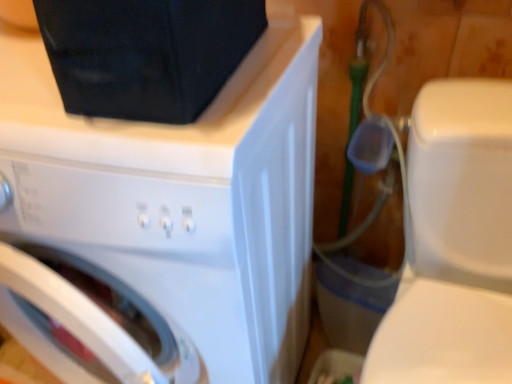
Measure the distance between white glossy toilet at right and camera.

white glossy toilet at right is 61.62 centimeters from camera.

Describe the element at coordinates (453, 242) in the screenshot. The image size is (512, 384). I see `white glossy toilet at right` at that location.

At what (x,y) coordinates should I click in order to perform the action: click on white glossy toilet at right. Please return your answer as a coordinate pair (x, y). The height and width of the screenshot is (384, 512). Looking at the image, I should click on (453, 242).

Describe the element at coordinates (163, 222) in the screenshot. This screenshot has height=384, width=512. I see `white glossy washing machine at upper left` at that location.

Identify the location of white glossy washing machine at upper left. (163, 222).

From the picture: What is the approximate height of white glossy washing machine at upper left?

The height of white glossy washing machine at upper left is 33.50 inches.

Locate an element on the screen. The image size is (512, 384). white glossy toilet at right is located at coordinates (453, 242).

Which is more to the left, white glossy toilet at right or white glossy washing machine at upper left?

white glossy washing machine at upper left is more to the left.

Between white glossy toilet at right and white glossy washing machine at upper left, which one is positioned behind?

white glossy washing machine at upper left is more distant.

Does point (460, 300) come in front of point (290, 146)?

No, it is behind (290, 146).

From the image's perspective, relative to white glossy washing machine at upper left, is white glossy toilet at right above or below?

white glossy toilet at right is below white glossy washing machine at upper left.

From a real-world perspective, between white glossy toilet at right and white glossy washing machine at upper left, who is vertically higher?

white glossy washing machine at upper left.

Does white glossy toilet at right have a lesser width compared to white glossy washing machine at upper left?

No.

From their relative heights in the image, would you say white glossy toilet at right is taller or shorter than white glossy washing machine at upper left?

Considering their sizes, white glossy toilet at right has less height than white glossy washing machine at upper left.

Between white glossy toilet at right and white glossy washing machine at upper left, which one has smaller size?

Smaller between the two is white glossy toilet at right.

Is white glossy toilet at right not within white glossy washing machine at upper left?

white glossy toilet at right is positioned outside white glossy washing machine at upper left.

Is there a large distance between white glossy toilet at right and white glossy washing machine at upper left?

No, white glossy toilet at right is not far from white glossy washing machine at upper left.

Is white glossy toilet at right facing away from white glossy washing machine at upper left?

That's not correct — white glossy toilet at right is not looking away from white glossy washing machine at upper left.

How different are the orientations of white glossy toilet at right and white glossy washing machine at upper left in degrees?

white glossy toilet at right and white glossy washing machine at upper left are facing 3.49 degrees away from each other.

Looking at this image, how far apart are white glossy toilet at right and white glossy washing machine at upper left?

white glossy toilet at right and white glossy washing machine at upper left are 12.85 inches apart from each other.

This screenshot has width=512, height=384. Find the location of `washing machine on the left of white glossy toilet at right`. washing machine on the left of white glossy toilet at right is located at coordinates (163, 222).

Looking at this image, considering the positions of objects white glossy washing machine at upper left and white glossy toilet at right in the image provided, who is more to the right, white glossy washing machine at upper left or white glossy toilet at right?

Positioned to the right is white glossy toilet at right.

Which object is closer to the camera taking this photo, white glossy washing machine at upper left or white glossy toilet at right?

white glossy toilet at right is more forward.

Between point (176, 370) and point (453, 293), which one is positioned behind?

The point (453, 293) is more distant.

From the image's perspective, between white glossy washing machine at upper left and white glossy toilet at right, which one is located above?

white glossy washing machine at upper left is shown above in the image.

From a real-world perspective, between white glossy washing machine at upper left and white glossy toilet at right, who is vertically lower?

white glossy toilet at right is physically lower.

Does white glossy washing machine at upper left have a greater width compared to white glossy toilet at right?

Incorrect, the width of white glossy washing machine at upper left does not surpass that of white glossy toilet at right.

Is white glossy washing machine at upper left shorter than white glossy toilet at right?

Incorrect, the height of white glossy washing machine at upper left does not fall short of that of white glossy toilet at right.

Is white glossy washing machine at upper left smaller than white glossy toilet at right?

No.

Is white glossy toilet at right inside white glossy washing machine at upper left?

No.

Does white glossy washing machine at upper left touch white glossy toilet at right?

No, white glossy washing machine at upper left is not with white glossy toilet at right.

Is white glossy washing machine at upper left looking in the opposite direction of white glossy toilet at right?

No, white glossy washing machine at upper left's orientation is not away from white glossy toilet at right.

How many degrees apart are the facing directions of white glossy washing machine at upper left and white glossy toilet at right?

The angle between the facing direction of white glossy washing machine at upper left and the facing direction of white glossy toilet at right is 3.49 degrees.

Measure the distance from white glossy washing machine at upper left to white glossy toilet at right.

white glossy washing machine at upper left and white glossy toilet at right are 12.85 inches apart.

Find the location of a particular element. This screenshot has height=384, width=512. washing machine lying above the white glossy toilet at right (from the image's perspective) is located at coordinates (163, 222).

Image resolution: width=512 pixels, height=384 pixels. I want to click on washing machine behind the white glossy toilet at right, so click(x=163, y=222).

I want to click on washer below the white glossy washing machine at upper left (from the image's perspective), so click(x=453, y=242).